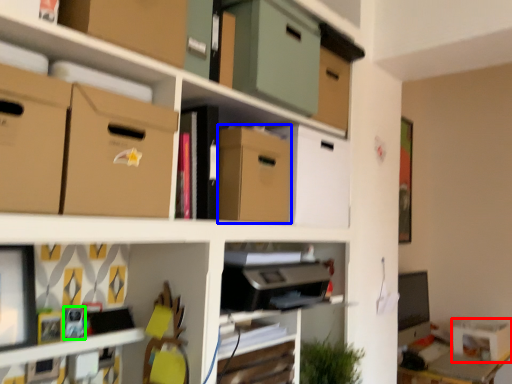
Question: Estimate the real-world distances between objects in this image. Which object is farther from storage box (highlighted by a red box), cardboard box (highlighted by a blue box) or toy (highlighted by a green box)?

Choices:
 (A) cardboard box
 (B) toy

Answer: (B)